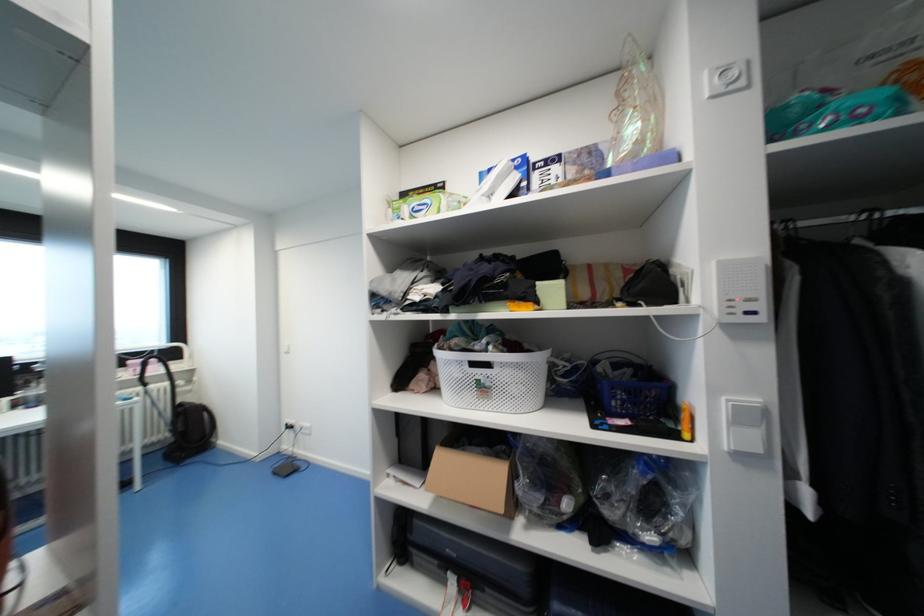
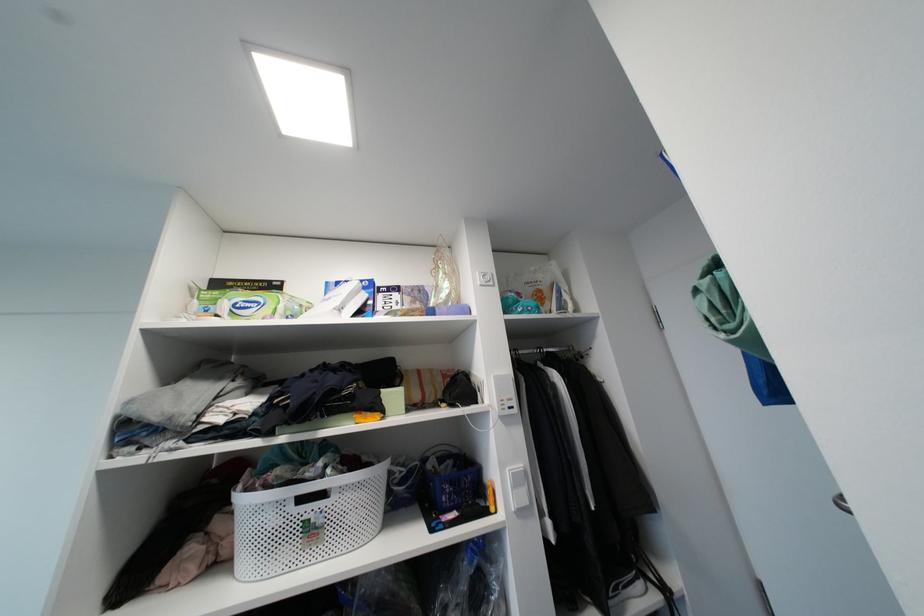
Find the pixel in the second image that matches [864,120] in the first image.

(533, 312)